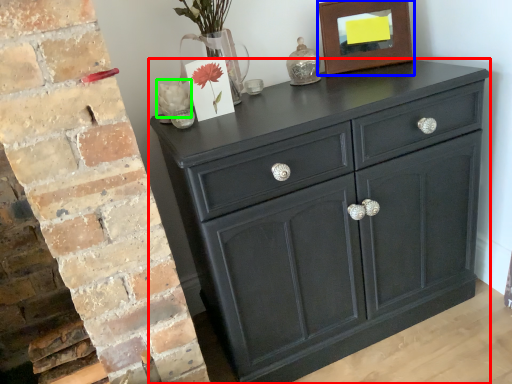
Question: Based on their relative distances, which object is nearer to chest of drawers (highlighted by a red box)? Choose from picture frame (highlighted by a blue box) and flower (highlighted by a green box).

Choices:
 (A) picture frame
 (B) flower

Answer: (A)